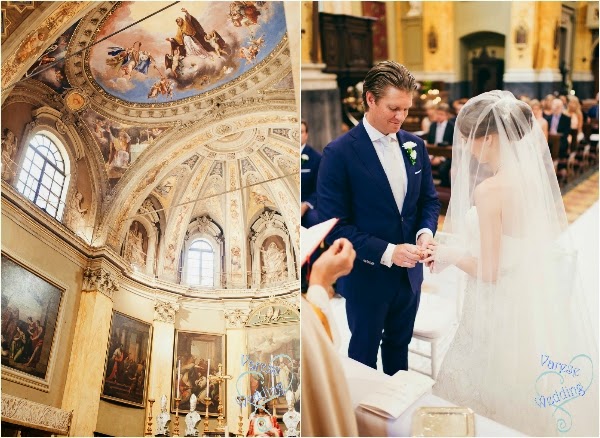
Identify the location of support pillar. (95, 337).